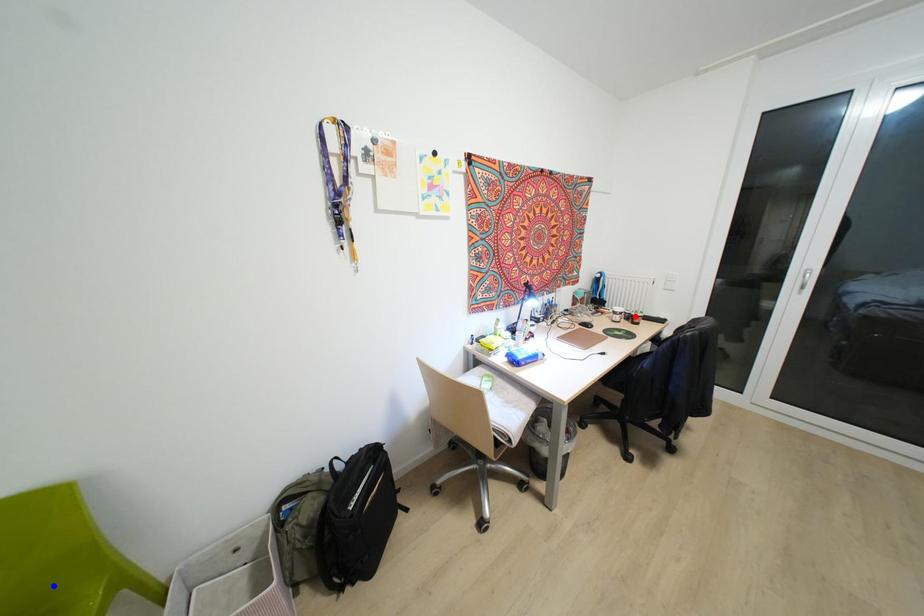
Question: In the image, two points are highlighted. Which point is nearer to the camera? Reply with the corresponding letter.

Choices:
 (A) blue point
 (B) red point

Answer: (A)